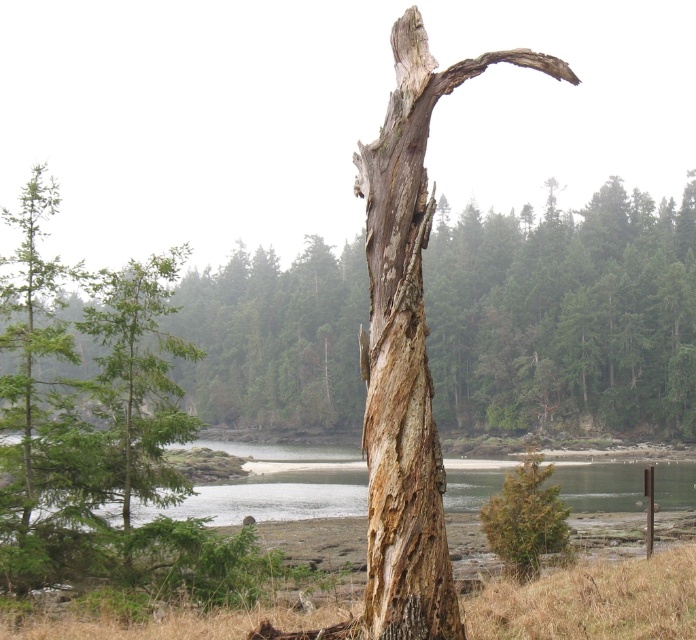
Question: Does weathered brown tree trunk at center come in front of dry grass at center?

Choices:
 (A) no
 (B) yes

Answer: (A)

Question: Which of the following is the farthest from the observer?

Choices:
 (A) (443, 564)
 (B) (358, 300)

Answer: (B)

Question: Estimate the real-world distances between objects in this image. Which object is farther from the weathered brown tree trunk at center?

Choices:
 (A) brown rough tree at lower right
 (B) brown textured wood at center

Answer: (B)

Question: Which object is the closest to the weathered brown tree trunk at center?

Choices:
 (A) brown textured wood at center
 (B) brown rough tree at lower right

Answer: (B)

Question: Is weathered brown tree trunk at center to the left of brown rough tree at lower right from the viewer's perspective?

Choices:
 (A) no
 (B) yes

Answer: (A)

Question: Does weathered brown tree trunk at center appear over brown textured wood at center?

Choices:
 (A) no
 (B) yes

Answer: (B)